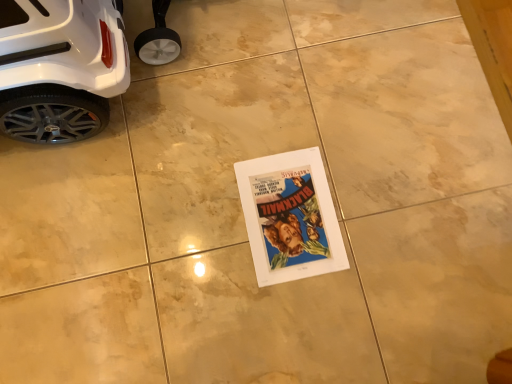
Where is `unoccupied region to the right of vibrant paper movie poster at center`? unoccupied region to the right of vibrant paper movie poster at center is located at coordinates (387, 211).